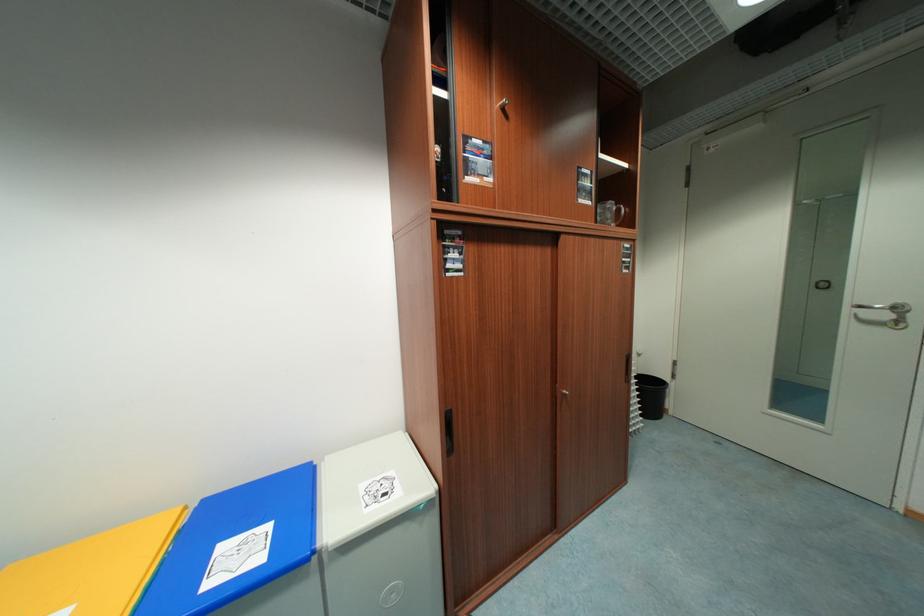
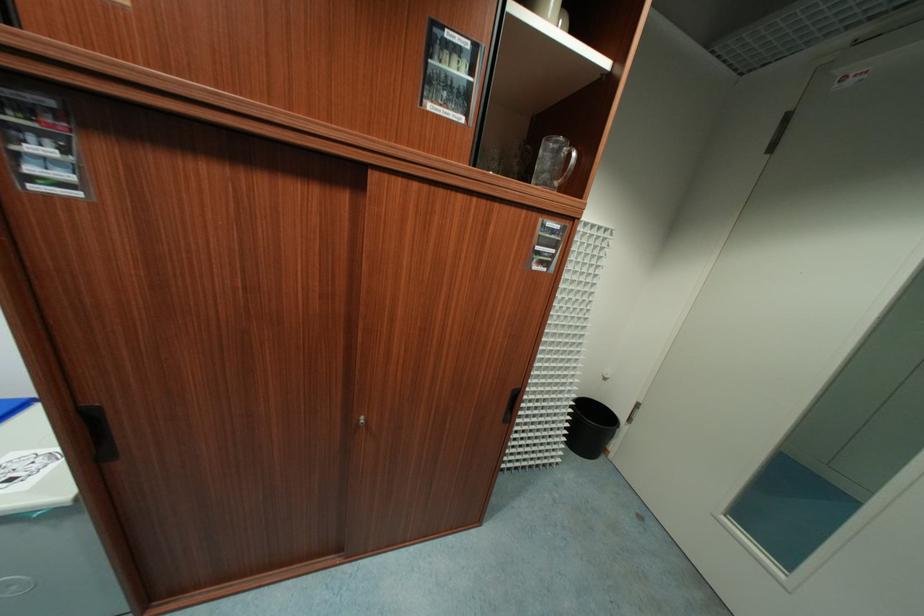
Question: The images are taken continuously from a first-person perspective. In which direction is your viewpoint rotating?

Choices:
 (A) Left
 (B) Right
 (C) Up
 (D) Down

Answer: (D)